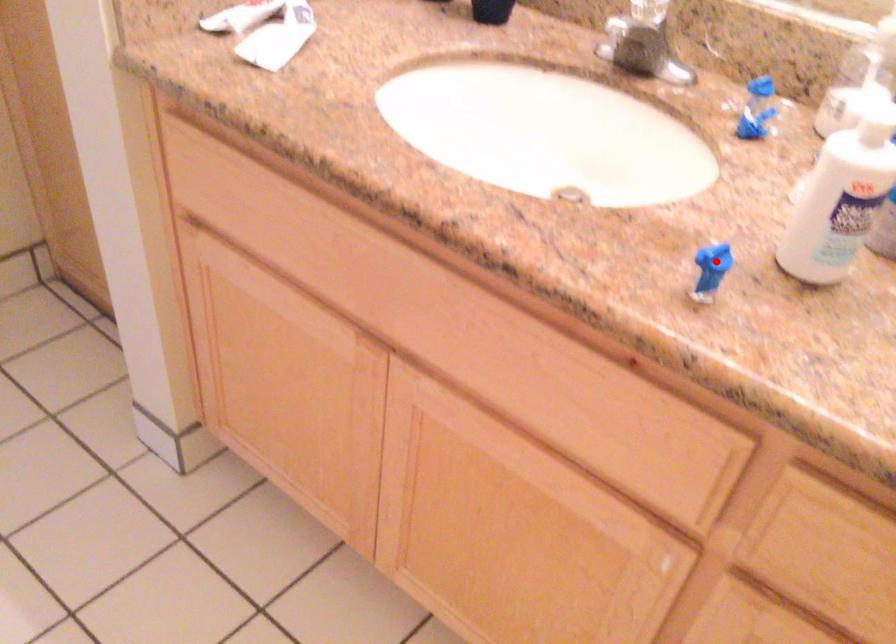
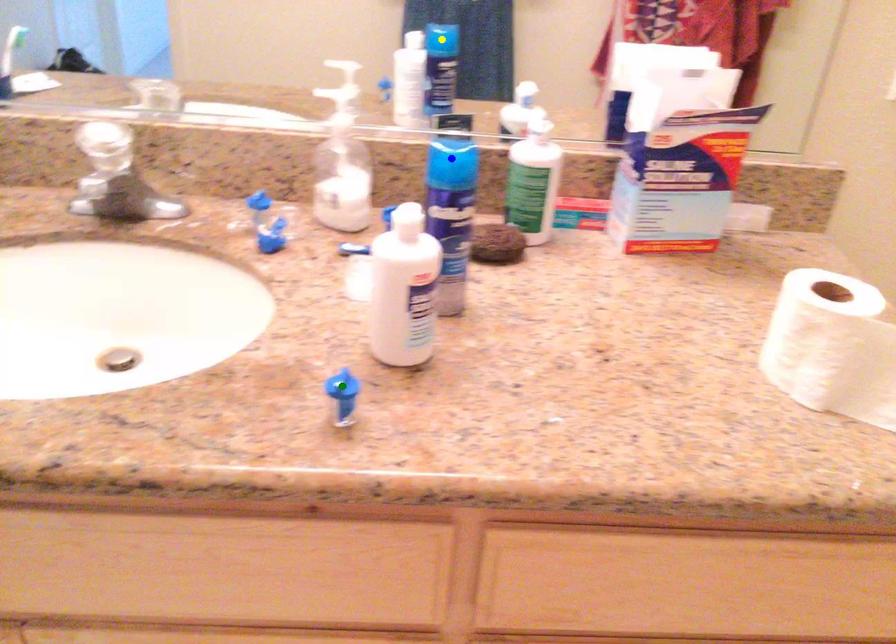
Question: I am providing you with two images of the same scene from different viewpoints. A red point is marked on the first image. You are given multiple points on the second image. Which spot in image 2 lines up with the point in image 1?

Choices:
 (A) yellow point
 (B) blue point
 (C) green point

Answer: (C)